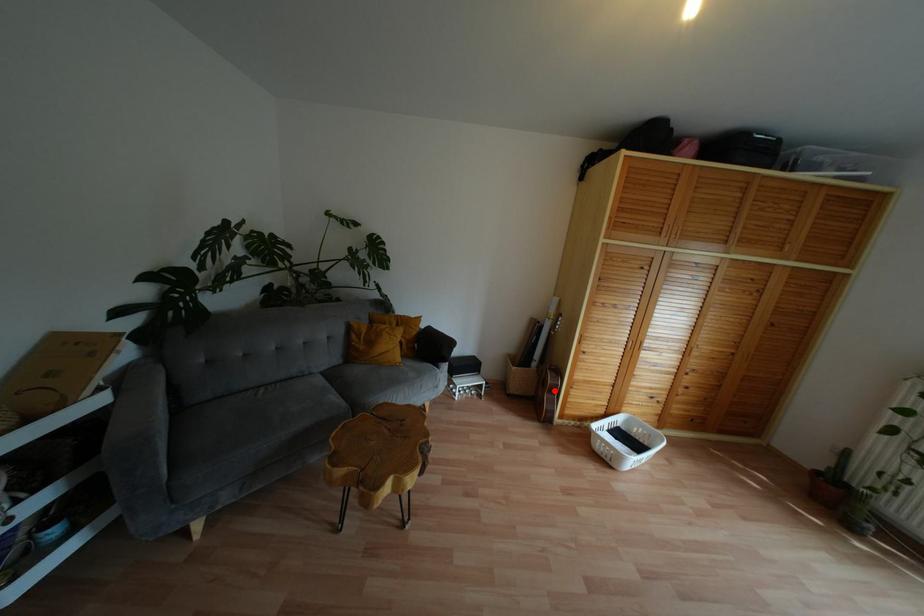
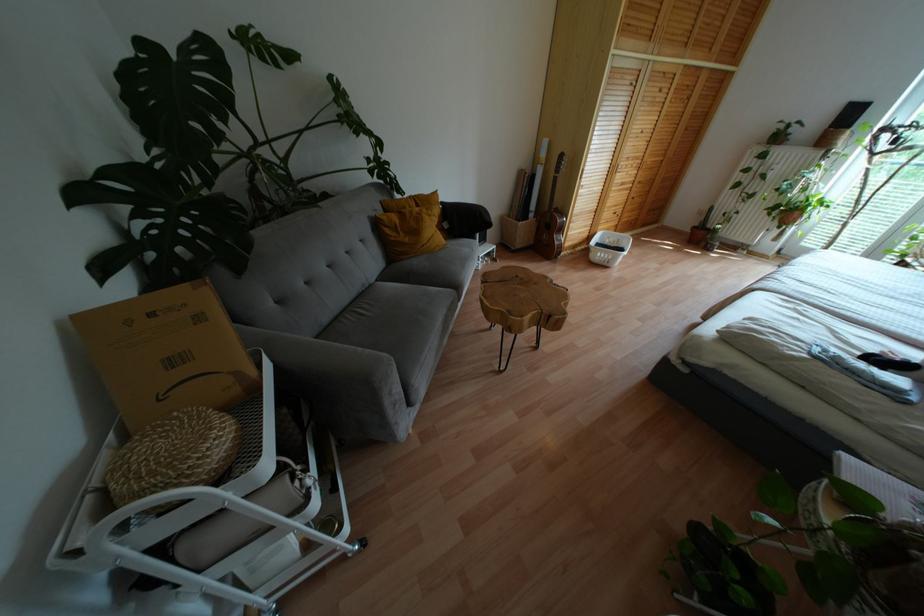
The point at the highlighted location is marked in the first image. Where is the corresponding point in the second image?

(560, 229)